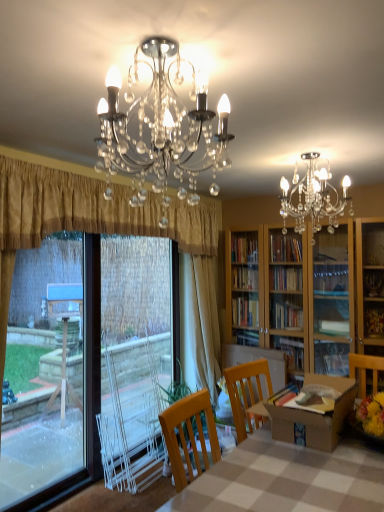
Question: Is gold textured curtain at left, placed as the second curtain when sorted from back to front, smaller than checkerboard fabric table at center?

Choices:
 (A) no
 (B) yes

Answer: (B)

Question: Is gold textured curtain at left, acting as the 1th curtain starting from the front, facing away from checkerboard fabric table at center?

Choices:
 (A) yes
 (B) no

Answer: (B)

Question: From a real-world perspective, is gold textured curtain at left, placed as the second curtain when sorted from back to front, located beneath checkerboard fabric table at center?

Choices:
 (A) no
 (B) yes

Answer: (A)

Question: From the image's perspective, is gold textured curtain at left, acting as the 1th curtain starting from the front, located beneath checkerboard fabric table at center?

Choices:
 (A) no
 (B) yes

Answer: (A)

Question: Does gold textured curtain at left, placed as the second curtain when sorted from back to front, come in front of checkerboard fabric table at center?

Choices:
 (A) yes
 (B) no

Answer: (B)

Question: Can you confirm if gold textured curtain at left, placed as the second curtain when sorted from back to front, is bigger than checkerboard fabric table at center?

Choices:
 (A) no
 (B) yes

Answer: (A)

Question: Can you confirm if beige fabric curtain at center, placed as the first curtain when sorted from back to front, is positioned to the right of transparent plastic window screen at left?

Choices:
 (A) no
 (B) yes

Answer: (B)

Question: Is beige fabric curtain at center, the second curtain when ordered from front to back, thinner than transparent plastic window screen at left?

Choices:
 (A) no
 (B) yes

Answer: (A)

Question: Is beige fabric curtain at center, the second curtain when ordered from front to back, further to the viewer compared to transparent plastic window screen at left?

Choices:
 (A) yes
 (B) no

Answer: (A)

Question: Can you confirm if beige fabric curtain at center, the second curtain when ordered from front to back, is bigger than transparent plastic window screen at left?

Choices:
 (A) no
 (B) yes

Answer: (B)

Question: From a real-world perspective, is beige fabric curtain at center, placed as the first curtain when sorted from back to front, physically below transparent plastic window screen at left?

Choices:
 (A) no
 (B) yes

Answer: (A)

Question: Does beige fabric curtain at center, placed as the first curtain when sorted from back to front, have a lesser height compared to transparent plastic window screen at left?

Choices:
 (A) no
 (B) yes

Answer: (A)

Question: Can you confirm if white plastic screen door at left is bigger than checkerboard fabric table at center?

Choices:
 (A) no
 (B) yes

Answer: (A)